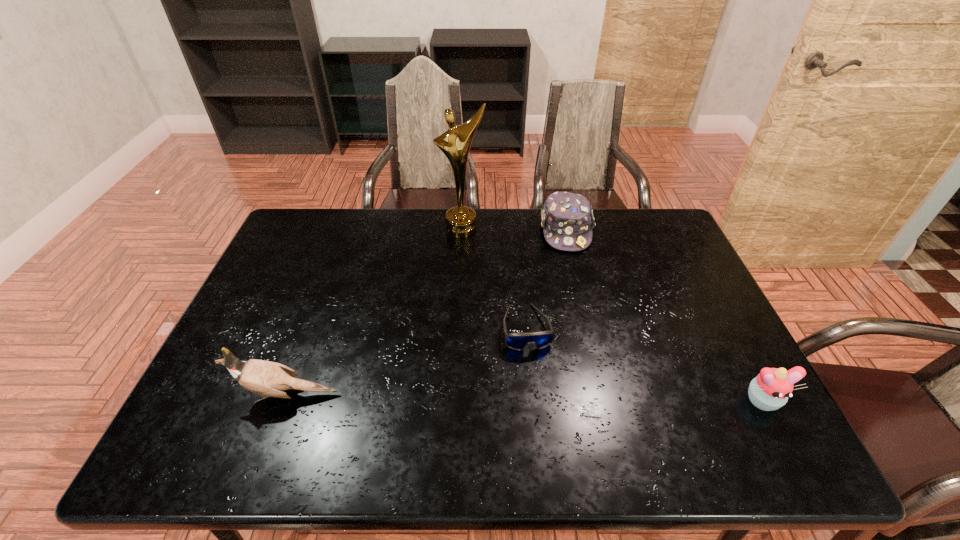
This screenshot has height=540, width=960. Identify the location of cupcake located in the near edge section of the desktop. (770, 390).

The height and width of the screenshot is (540, 960). Find the location of `object present at the left edge`. object present at the left edge is located at coordinates pos(266,378).

Find the location of a particular element. object present at the right edge is located at coordinates (770, 390).

The height and width of the screenshot is (540, 960). I want to click on object at the near left corner, so click(266, 378).

This screenshot has height=540, width=960. I want to click on object at the near right corner, so click(x=770, y=390).

At what (x,y) coordinates should I click in order to perform the action: click on vacant space at the far edge of the desktop. Please return your answer as a coordinate pair (x, y). The width and height of the screenshot is (960, 540). Looking at the image, I should click on (595, 221).

Where is `vacant space at the near edge of the desktop`? The height and width of the screenshot is (540, 960). vacant space at the near edge of the desktop is located at coordinates (588, 386).

Where is `free space at the left edge of the desktop`? The image size is (960, 540). free space at the left edge of the desktop is located at coordinates (238, 325).

Where is `free space at the right edge`? This screenshot has height=540, width=960. free space at the right edge is located at coordinates (745, 377).

In order to click on vacant area at the far right corner in this screenshot , I will do `click(640, 209)`.